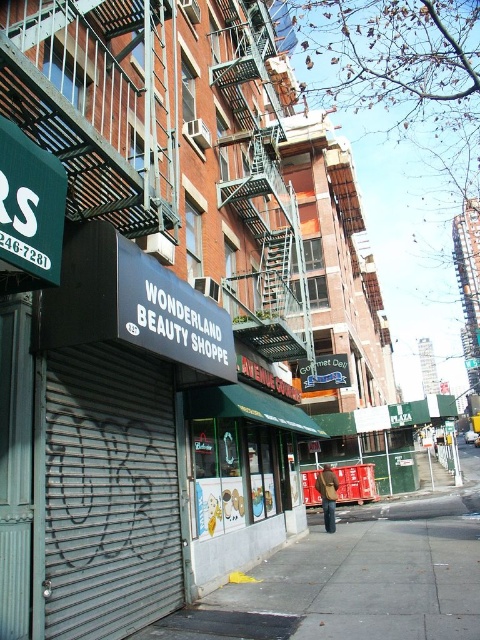
Measure the distance between concrete sidewalk at lower center and camera.

A distance of 3.53 meters exists between concrete sidewalk at lower center and camera.

Is point (476, 582) closer to camera compared to point (310, 316)?

Yes, it is in front of point (310, 316).

Where is `concrete sidewalk at lower center`? The image size is (480, 640). concrete sidewalk at lower center is located at coordinates (359, 577).